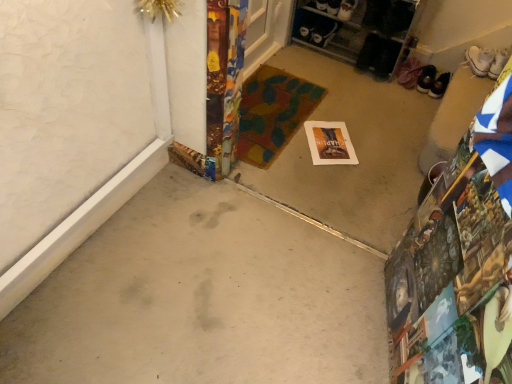
The height and width of the screenshot is (384, 512). Describe the element at coordinates (426, 79) in the screenshot. I see `black leather shoes at upper right, which is the third footwear in right-to-left order` at that location.

Locate an element on the screen. black leather shoes at upper right, which is the 1th footwear from left to right is located at coordinates [426, 79].

What is the approximate width of multicolored fabric doormat at center?

The width of multicolored fabric doormat at center is 27.87 inches.

The image size is (512, 384). In order to click on black leather shoes at upper right, which ranks as the 2th footwear in right-to-left order in this screenshot , I will do `click(439, 86)`.

In order to face smooth concrete floor at center, which appears as the 2th concrete when viewed from the front, should I rotate leftwards or rightwards?

A 10.463 degree turn to the right will do.

Find the location of a particular element. The image size is (512, 384). gray concrete at center, the second concrete from the back is located at coordinates (202, 298).

From a real-world perspective, count 2nd concretes downward from the multicolored fabric doormat at center and point to it. Please provide its 2D coordinates.

[(202, 298)]

Is gray concrete at center, marked as the 1th concrete in a front-to-back arrangement, turned away from multicolored fabric doormat at center?

No.

Would you say gray concrete at center, marked as the 1th concrete in a front-to-back arrangement, is outside multicolored fabric doormat at center?

gray concrete at center, marked as the 1th concrete in a front-to-back arrangement, is positioned outside multicolored fabric doormat at center.

From a real-world perspective, which object rests below the other?

gray concrete at center, marked as the 1th concrete in a front-to-back arrangement, is physically lower.

Can you tell me how much gray concrete at center, marked as the 1th concrete in a front-to-back arrangement, and smooth concrete floor at center, which is the 1th concrete in back-to-front order, differ in facing direction?

90.3 degrees separate the facing orientations of gray concrete at center, marked as the 1th concrete in a front-to-back arrangement, and smooth concrete floor at center, which is the 1th concrete in back-to-front order.

Between point (213, 359) and point (362, 105), which one is positioned behind?

Point (362, 105)

Considering the sizes of gray concrete at center, the second concrete from the back, and smooth concrete floor at center, which appears as the 2th concrete when viewed from the front, in the image, is gray concrete at center, the second concrete from the back, taller or shorter than smooth concrete floor at center, which appears as the 2th concrete when viewed from the front,?

gray concrete at center, the second concrete from the back, is taller than smooth concrete floor at center, which appears as the 2th concrete when viewed from the front.

Considering the positions of objects gray concrete at center, the second concrete from the back, and smooth concrete floor at center, which appears as the 2th concrete when viewed from the front, in the image provided, who is behind, gray concrete at center, the second concrete from the back, or smooth concrete floor at center, which appears as the 2th concrete when viewed from the front,?

smooth concrete floor at center, which appears as the 2th concrete when viewed from the front, is further from the camera.

From a real-world perspective, which is physically below, white canvas sneakers at upper right, arranged as the 3th footwear when viewed from the left, or matte paper postcard at center?

In real-world perspective, matte paper postcard at center is lower.

Is white canvas sneakers at upper right, which is the first footwear in right-to-left order, far away from matte paper postcard at center?

No.

Is white canvas sneakers at upper right, arranged as the 3th footwear when viewed from the left, situated inside matte paper postcard at center or outside?

white canvas sneakers at upper right, arranged as the 3th footwear when viewed from the left, exists outside the volume of matte paper postcard at center.

From the image's perspective, is white canvas sneakers at upper right, arranged as the 3th footwear when viewed from the left, beneath matte paper postcard at center?

No, from the image's perspective, white canvas sneakers at upper right, arranged as the 3th footwear when viewed from the left, is not below matte paper postcard at center.

How many degrees apart are the facing directions of matte paper postcard at center and multicolored fabric doormat at center?

matte paper postcard at center and multicolored fabric doormat at center are facing 35.4 degrees away from each other.

From a real-world perspective, which is physically above, matte paper postcard at center or multicolored fabric doormat at center?

multicolored fabric doormat at center, from a real-world perspective.

Is matte paper postcard at center facing away from multicolored fabric doormat at center?

That's not correct — matte paper postcard at center is not looking away from multicolored fabric doormat at center.

Is matte paper postcard at center in front of or behind multicolored fabric doormat at center in the image?

Visually, matte paper postcard at center is located behind multicolored fabric doormat at center.

Is matte paper postcard at center facing towards white canvas sneakers at upper right, which is the first footwear in right-to-left order?

No, matte paper postcard at center is not facing towards white canvas sneakers at upper right, which is the first footwear in right-to-left order.

From the image's perspective, is matte paper postcard at center on white canvas sneakers at upper right, arranged as the 3th footwear when viewed from the left?

No.

From a real-world perspective, does matte paper postcard at center sit lower than white canvas sneakers at upper right, which is the first footwear in right-to-left order?

Yes, from a real-world perspective, matte paper postcard at center is under white canvas sneakers at upper right, which is the first footwear in right-to-left order.

Would you consider matte paper postcard at center to be distant from white canvas sneakers at upper right, arranged as the 3th footwear when viewed from the left?

No.

From the picture: From the image's perspective, which one is positioned higher, black leather shoes at upper right, which is the third footwear in right-to-left order, or matte paper postcard at center?

black leather shoes at upper right, which is the third footwear in right-to-left order.

There is a matte paper postcard at center. Identify the location of the 2nd footwear above it (from the image's perspective). (426, 79).

Which object is thinner, black leather shoes at upper right, which is the third footwear in right-to-left order, or matte paper postcard at center?

With smaller width is black leather shoes at upper right, which is the third footwear in right-to-left order.

From the picture: Considering the relative sizes of black leather shoes at upper right, which is the 1th footwear from left to right, and smooth concrete floor at center, which appears as the 2th concrete when viewed from the front, in the image provided, is black leather shoes at upper right, which is the 1th footwear from left to right, bigger than smooth concrete floor at center, which appears as the 2th concrete when viewed from the front,?

No, black leather shoes at upper right, which is the 1th footwear from left to right, is not bigger than smooth concrete floor at center, which appears as the 2th concrete when viewed from the front.

You are a GUI agent. You are given a task and a screenshot of the screen. Output one action in this format:
    pyautogui.click(x=<x>, y=<y>)
    Task: Click on the footwear that is the 3rd object located behind the smooth concrete floor at center, which is the 1th concrete in back-to-front order
    
    Given the screenshot: What is the action you would take?
    pyautogui.click(x=426, y=79)

Is black leather shoes at upper right, which is the 1th footwear from left to right, inside the boundaries of smooth concrete floor at center, which appears as the 2th concrete when viewed from the front, or outside?

black leather shoes at upper right, which is the 1th footwear from left to right, is spatially situated outside smooth concrete floor at center, which appears as the 2th concrete when viewed from the front.

Is black leather shoes at upper right, which is the 1th footwear from left to right, further to camera compared to smooth concrete floor at center, which appears as the 2th concrete when viewed from the front?

Yes, black leather shoes at upper right, which is the 1th footwear from left to right, is behind smooth concrete floor at center, which appears as the 2th concrete when viewed from the front.

Locate an element on the screen. The width and height of the screenshot is (512, 384). doormat located on the right of gray concrete at center, the second concrete from the back is located at coordinates (272, 113).

At what (x,y) coordinates should I click in order to perform the action: click on concrete located on the left of smooth concrete floor at center, which is the 1th concrete in back-to-front order. Please return your answer as a coordinate pair (x, y). The image size is (512, 384). Looking at the image, I should click on (202, 298).

Estimate the real-world distances between objects in this image. Which object is closer to matte paper postcard at center, black leather shoes at upper right, which ranks as the 2th footwear in right-to-left order, or black leather shoes at upper right, which is the 1th footwear from left to right?

black leather shoes at upper right, which is the 1th footwear from left to right, is positioned closer to the anchor matte paper postcard at center.

From the picture: Considering their positions, is smooth concrete floor at center, which is the 1th concrete in back-to-front order, positioned further to multicolored fabric doormat at center than gray concrete at center, marked as the 1th concrete in a front-to-back arrangement?

gray concrete at center, marked as the 1th concrete in a front-to-back arrangement, is further to multicolored fabric doormat at center.

When comparing their distances from smooth concrete floor at center, which is the 1th concrete in back-to-front order, does white canvas sneakers at upper right, arranged as the 3th footwear when viewed from the left, or gray concrete at center, marked as the 1th concrete in a front-to-back arrangement, seem further?

white canvas sneakers at upper right, arranged as the 3th footwear when viewed from the left, is further to smooth concrete floor at center, which is the 1th concrete in back-to-front order.

Estimate the real-world distances between objects in this image. Which object is further from black leather shoes at upper right, which is the third footwear in right-to-left order, multicolored fabric doormat at center or white canvas sneakers at upper right, arranged as the 3th footwear when viewed from the left?

Among the two, multicolored fabric doormat at center is located further to black leather shoes at upper right, which is the third footwear in right-to-left order.

Which object lies further to the anchor point black leather shoes at upper right, which ranks as the 2th footwear in right-to-left order, matte paper postcard at center or black leather shoes at upper right, which is the third footwear in right-to-left order?

matte paper postcard at center lies further to black leather shoes at upper right, which ranks as the 2th footwear in right-to-left order, than the other object.

In the scene shown: From the image, which object appears to be farther from matte paper postcard at center, smooth concrete floor at center, which appears as the 2th concrete when viewed from the front, or black leather shoes at upper right, which is the 1th footwear from left to right?

black leather shoes at upper right, which is the 1th footwear from left to right.

Considering their positions, is white canvas sneakers at upper right, which is the first footwear in right-to-left order, positioned closer to black leather shoes at upper right, positioned as the second footwear in left-to-right order, than gray concrete at center, the second concrete from the back?

white canvas sneakers at upper right, which is the first footwear in right-to-left order, is closer to black leather shoes at upper right, positioned as the second footwear in left-to-right order.

When comparing their distances from black leather shoes at upper right, which is the third footwear in right-to-left order, does black leather shoes at upper right, which ranks as the 2th footwear in right-to-left order, or gray concrete at center, marked as the 1th concrete in a front-to-back arrangement, seem closer?

Among the two, black leather shoes at upper right, which ranks as the 2th footwear in right-to-left order, is located nearer to black leather shoes at upper right, which is the third footwear in right-to-left order.

Where is `doormat between gray concrete at center, marked as the 1th concrete in a front-to-back arrangement, and matte paper postcard at center, along the z-axis`? This screenshot has height=384, width=512. doormat between gray concrete at center, marked as the 1th concrete in a front-to-back arrangement, and matte paper postcard at center, along the z-axis is located at coordinates (272, 113).

This screenshot has height=384, width=512. Find the location of `concrete between matte paper postcard at center and black leather shoes at upper right, positioned as the second footwear in left-to-right order, from left to right`. concrete between matte paper postcard at center and black leather shoes at upper right, positioned as the second footwear in left-to-right order, from left to right is located at coordinates (355, 151).

Image resolution: width=512 pixels, height=384 pixels. I want to click on doormat between gray concrete at center, marked as the 1th concrete in a front-to-back arrangement, and black leather shoes at upper right, positioned as the second footwear in left-to-right order, in the front-back direction, so click(272, 113).

The width and height of the screenshot is (512, 384). I want to click on concrete situated between matte paper postcard at center and white canvas sneakers at upper right, arranged as the 3th footwear when viewed from the left, from left to right, so click(355, 151).